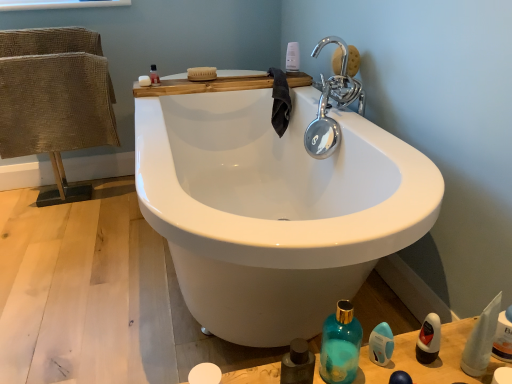
Question: Is translucent plastic mouthwash at upper left, positioned as the 1th mouthwash in back-to-front order, outside teal glass bottle at lower right?

Choices:
 (A) no
 (B) yes

Answer: (B)

Question: Is translucent plastic mouthwash at upper left, positioned as the 1th mouthwash in back-to-front order, oriented away from teal glass bottle at lower right?

Choices:
 (A) no
 (B) yes

Answer: (A)

Question: Is translucent plastic mouthwash at upper left, which is the 3th mouthwash in front-to-back order, closer to camera compared to teal glass bottle at lower right?

Choices:
 (A) yes
 (B) no

Answer: (B)

Question: Could you tell me if translucent plastic mouthwash at upper left, which appears as the first mouthwash when viewed from the top, is facing teal glass bottle at lower right?

Choices:
 (A) no
 (B) yes

Answer: (A)

Question: Is translucent plastic mouthwash at upper left, acting as the 3th mouthwash starting from the bottom, placed right next to teal glass bottle at lower right?

Choices:
 (A) yes
 (B) no

Answer: (B)

Question: Is teal glass bottle at lower right bigger or smaller than burlap fabric chair at left?

Choices:
 (A) small
 (B) big

Answer: (A)

Question: From their relative heights in the image, would you say teal glass bottle at lower right is taller or shorter than burlap fabric chair at left?

Choices:
 (A) short
 (B) tall

Answer: (A)

Question: From the image's perspective, is teal glass bottle at lower right located above or below burlap fabric chair at left?

Choices:
 (A) above
 (B) below

Answer: (B)

Question: Considering the positions of point (344, 319) and point (10, 100), is point (344, 319) closer or farther from the camera than point (10, 100)?

Choices:
 (A) closer
 (B) farther

Answer: (A)

Question: In terms of width, does teal glass bottle at lower right look wider or thinner when compared to translucent plastic mouthwash at upper left, arranged as the 1th mouthwash when viewed from the left?

Choices:
 (A) thin
 (B) wide

Answer: (B)

Question: Is teal glass bottle at lower right in front of or behind translucent plastic mouthwash at upper left, which appears as the first mouthwash when viewed from the top, in the image?

Choices:
 (A) front
 (B) behind

Answer: (A)

Question: From their relative heights in the image, would you say teal glass bottle at lower right is taller or shorter than translucent plastic mouthwash at upper left, which appears as the first mouthwash when viewed from the top?

Choices:
 (A) tall
 (B) short

Answer: (A)

Question: Is teal glass bottle at lower right inside or outside of translucent plastic mouthwash at upper left, the 3th mouthwash viewed from the right?

Choices:
 (A) inside
 (B) outside

Answer: (B)

Question: Considering their positions, is white matte soap at upper center located in front of or behind white plastic bottle at upper center, placed as the 3th toiletry when sorted from bottom to top?

Choices:
 (A) front
 (B) behind

Answer: (A)

Question: Based on their positions, is white matte soap at upper center located to the left or right of white plastic bottle at upper center, marked as the third toiletry in a front-to-back arrangement?

Choices:
 (A) left
 (B) right

Answer: (A)